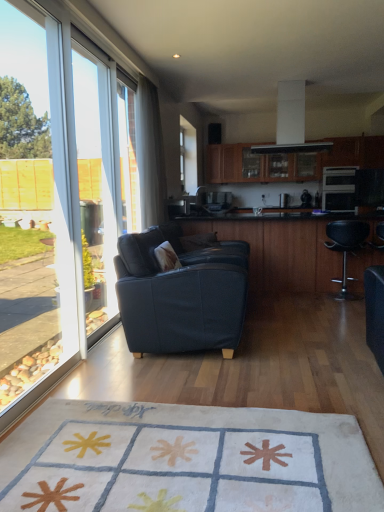
Locate an element on the screen. The width and height of the screenshot is (384, 512). free spot in front of dark blue fabric couch at center is located at coordinates (188, 391).